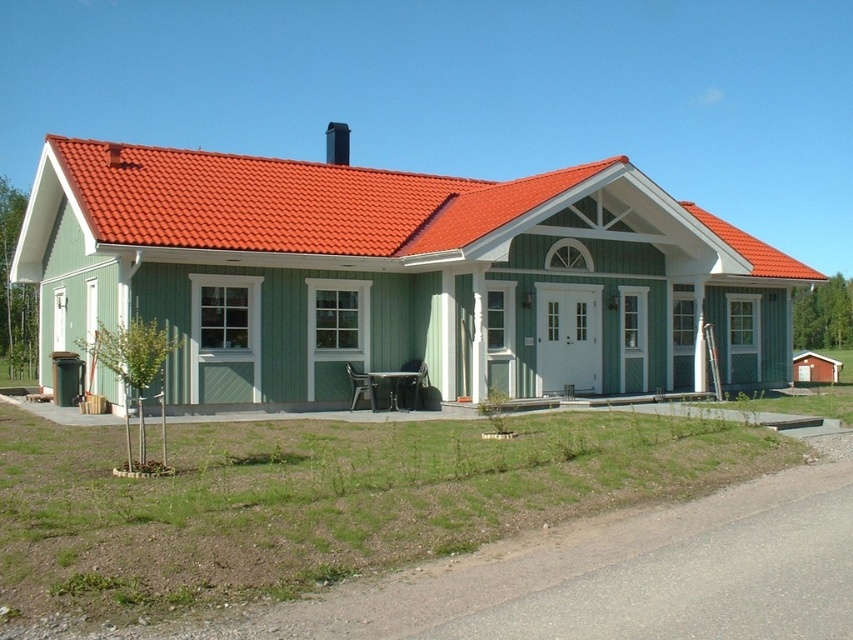
Question: Among these points, which one is nearest to the camera?

Choices:
 (A) (335, 138)
 (B) (355, 234)

Answer: (B)

Question: Does red tile roof at upper center lie behind black smooth chimney at upper center?

Choices:
 (A) no
 (B) yes

Answer: (A)

Question: Is red tile roof at upper center wider than black smooth chimney at upper center?

Choices:
 (A) yes
 (B) no

Answer: (A)

Question: Which object appears closest to the camera in this image?

Choices:
 (A) black smooth chimney at upper center
 (B) red tile roof at upper center

Answer: (B)

Question: Does red tile roof at upper center have a greater width compared to black smooth chimney at upper center?

Choices:
 (A) no
 (B) yes

Answer: (B)